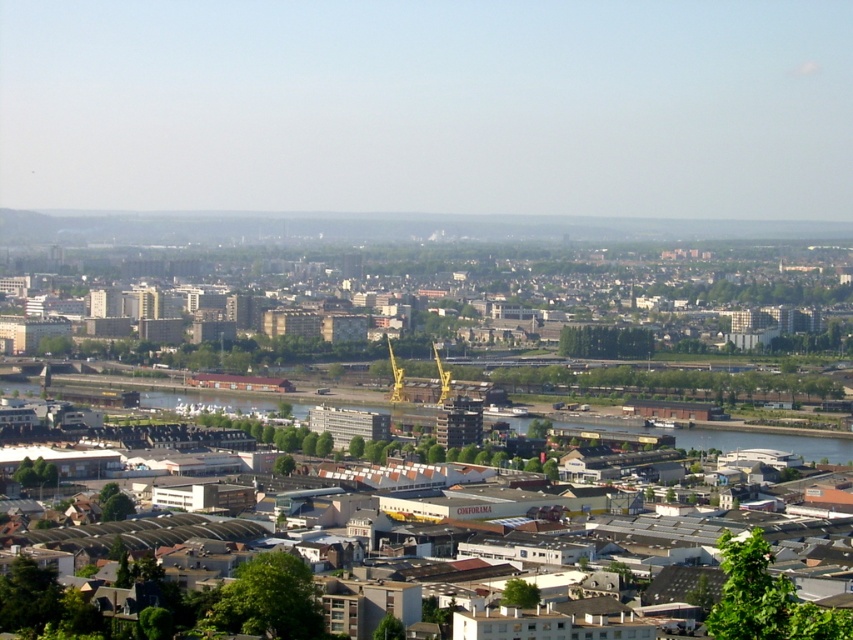
Consider the image. You are standing at the vantage point where the image was taken. You see the gray concrete buildings at center and the brown brick buildings at center. How far apart are these two sets of buildings from your current position?

The gray concrete buildings at center is 26.02 feet away from brown brick buildings at center.

You are a city planner reviewing this area and want to know if the brown brick buildings at center are located above the green concrete waterway at lower center. Based on the image, can you confirm this?

The brown brick buildings at center is positioned over green concrete waterway at lower center, so yes, the brown brick buildings at center are located above the green concrete waterway at lower center.